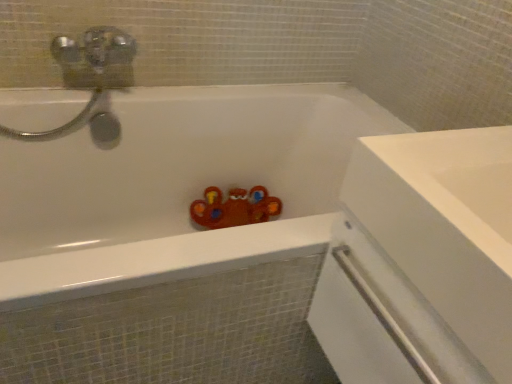
Question: Considering the positions of white glossy bathtub at center and clear plastic screen door at right in the image, is white glossy bathtub at center bigger or smaller than clear plastic screen door at right?

Choices:
 (A) small
 (B) big

Answer: (B)

Question: Which is correct: white glossy bathtub at center is inside clear plastic screen door at right, or outside of it?

Choices:
 (A) outside
 (B) inside

Answer: (A)

Question: From a real-world perspective, relative to clear plastic screen door at right, is white glossy bathtub at center vertically above or below?

Choices:
 (A) below
 (B) above

Answer: (A)

Question: In terms of width, does clear plastic screen door at right look wider or thinner when compared to white glossy bathtub at center?

Choices:
 (A) thin
 (B) wide

Answer: (A)

Question: From the image's perspective, is clear plastic screen door at right above or below white glossy bathtub at center?

Choices:
 (A) above
 (B) below

Answer: (B)

Question: Is clear plastic screen door at right in front of or behind white glossy bathtub at center in the image?

Choices:
 (A) front
 (B) behind

Answer: (A)

Question: Considering the positions of clear plastic screen door at right and white glossy bathtub at center in the image, is clear plastic screen door at right taller or shorter than white glossy bathtub at center?

Choices:
 (A) tall
 (B) short

Answer: (B)